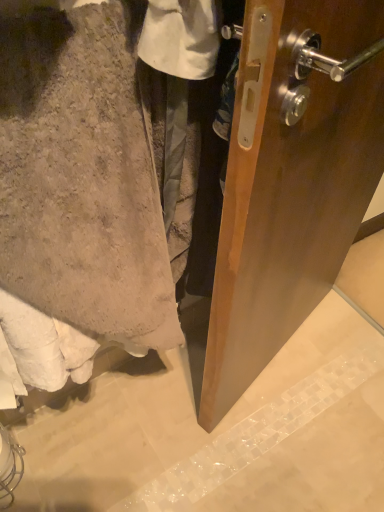
Question: In terms of size, does beige fuzzy towel at lower left appear bigger or smaller than smooth concrete wall at lower left?

Choices:
 (A) big
 (B) small

Answer: (A)

Question: In the image, is beige fuzzy towel at lower left positioned in front of or behind smooth concrete wall at lower left?

Choices:
 (A) front
 (B) behind

Answer: (A)

Question: Does point (82, 265) appear closer or farther from the camera than point (289, 438)?

Choices:
 (A) closer
 (B) farther

Answer: (A)

Question: In terms of height, does smooth concrete wall at lower left look taller or shorter compared to beige fuzzy towel at lower left?

Choices:
 (A) short
 (B) tall

Answer: (A)

Question: From a real-world perspective, is smooth concrete wall at lower left positioned above or below beige fuzzy towel at lower left?

Choices:
 (A) below
 (B) above

Answer: (A)

Question: Does point (163, 415) appear closer or farther from the camera than point (104, 122)?

Choices:
 (A) farther
 (B) closer

Answer: (A)

Question: In the image, is smooth concrete wall at lower left positioned in front of or behind beige fuzzy towel at lower left?

Choices:
 (A) behind
 (B) front

Answer: (A)